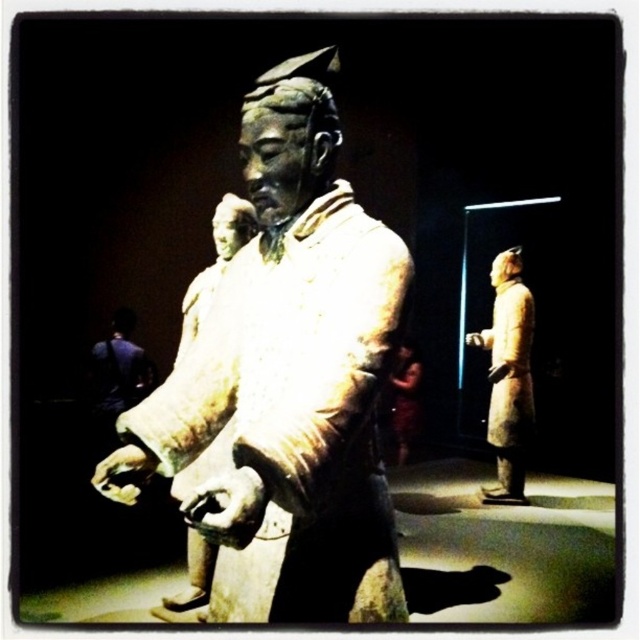
Question: Among these points, which one is farthest from the camera?

Choices:
 (A) click(x=380, y=304)
 (B) click(x=209, y=492)
 (C) click(x=129, y=456)
 (D) click(x=483, y=490)

Answer: (D)

Question: Among these points, which one is farthest from the camera?

Choices:
 (A) (256, 129)
 (B) (257, 509)

Answer: (A)

Question: Does matte bronze warrior at center have a smaller size compared to matte gray figure at right?

Choices:
 (A) no
 (B) yes

Answer: (A)

Question: Can you confirm if matte bronze warrior at center is positioned below smooth clay hand at center?

Choices:
 (A) no
 (B) yes

Answer: (A)

Question: Can you confirm if matte bronze warrior at center is thinner than smooth clay hand at center?

Choices:
 (A) no
 (B) yes

Answer: (A)

Question: Which of these objects is positioned closest to the smooth clay hand at center?

Choices:
 (A) matte bronze warrior at center
 (B) matte gray figure at right
 (C) smooth bronze hand at center

Answer: (C)